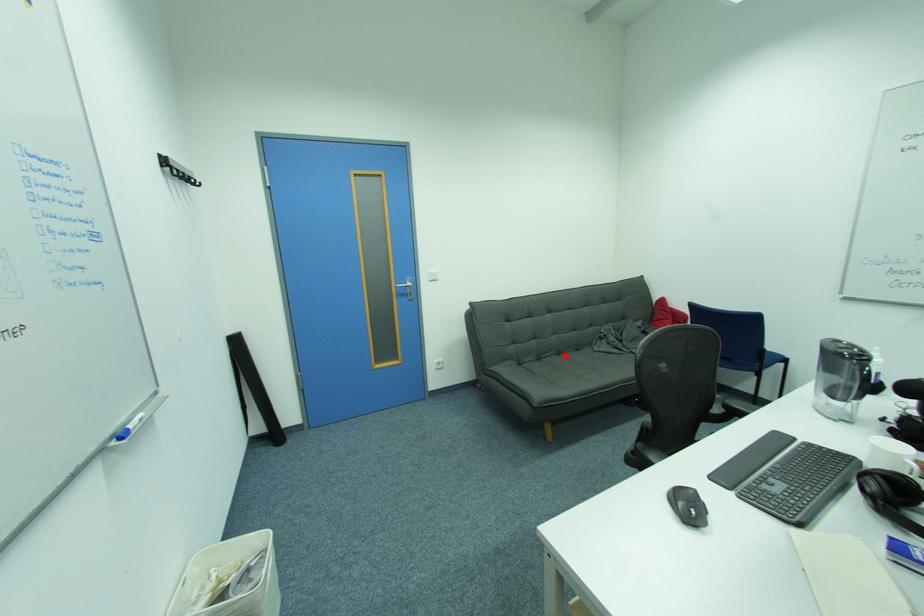
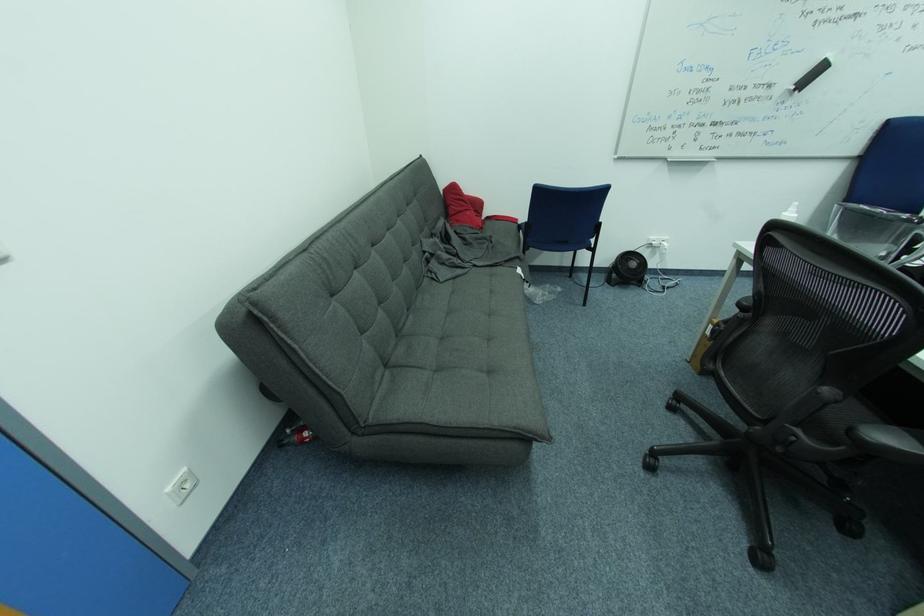
Question: I am providing you with two images of the same scene from different viewpoints. A red point is marked on the first image. At the location where the point appears in image 1, is it still visible in image 2?

Choices:
 (A) Yes
 (B) No

Answer: (A)